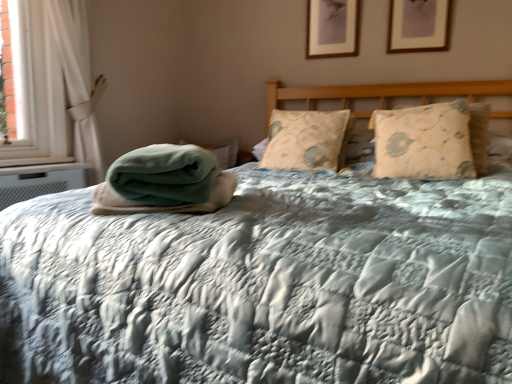
Question: Is beige quilted pillow at right, the first pillow positioned from the right, oriented away from white fabric curtain at left?

Choices:
 (A) no
 (B) yes

Answer: (A)

Question: From a real-world perspective, is beige quilted pillow at right, the first pillow positioned from the right, below white fabric curtain at left?

Choices:
 (A) yes
 (B) no

Answer: (A)

Question: Can you confirm if beige quilted pillow at right, the first pillow positioned from the right, is wider than white fabric curtain at left?

Choices:
 (A) yes
 (B) no

Answer: (A)

Question: Does beige quilted pillow at right, the first pillow positioned from the right, appear on the right side of white fabric curtain at left?

Choices:
 (A) yes
 (B) no

Answer: (A)

Question: Considering the relative positions of beige quilted pillow at right, placed as the second pillow when sorted from left to right, and white fabric curtain at left in the image provided, is beige quilted pillow at right, placed as the second pillow when sorted from left to right, behind white fabric curtain at left?

Choices:
 (A) yes
 (B) no

Answer: (B)

Question: Based on their sizes in the image, would you say beige quilted pillow at right, placed as the second pillow when sorted from left to right, is bigger or smaller than matte wooden picture frame at upper center, the second picture frame viewed from the right?

Choices:
 (A) small
 (B) big

Answer: (B)

Question: Considering the positions of beige quilted pillow at right, the first pillow positioned from the right, and matte wooden picture frame at upper center, the second picture frame viewed from the right, in the image, is beige quilted pillow at right, the first pillow positioned from the right, wider or thinner than matte wooden picture frame at upper center, the second picture frame viewed from the right,?

Choices:
 (A) thin
 (B) wide

Answer: (B)

Question: Does point click(442, 130) appear closer or farther from the camera than point click(334, 44)?

Choices:
 (A) closer
 (B) farther

Answer: (A)

Question: From the image's perspective, is beige quilted pillow at right, placed as the second pillow when sorted from left to right, above or below matte wooden picture frame at upper center, which is the 1th picture frame from left to right?

Choices:
 (A) below
 (B) above

Answer: (A)

Question: Is point click(x=197, y=148) positioned closer to the camera than point click(x=338, y=56)?

Choices:
 (A) farther
 (B) closer

Answer: (B)

Question: From a real-world perspective, is green textured blanket at center positioned above or below matte wooden picture frame at upper center, the second picture frame viewed from the right?

Choices:
 (A) above
 (B) below

Answer: (B)

Question: Considering the positions of green textured blanket at center and matte wooden picture frame at upper center, which is the 1th picture frame from left to right, in the image, is green textured blanket at center bigger or smaller than matte wooden picture frame at upper center, which is the 1th picture frame from left to right,?

Choices:
 (A) big
 (B) small

Answer: (A)

Question: Looking at their shapes, would you say green textured blanket at center is wider or thinner than matte wooden picture frame at upper center, the second picture frame viewed from the right?

Choices:
 (A) thin
 (B) wide

Answer: (B)

Question: Considering the relative positions of wooden picture frame at upper center, arranged as the 2th picture frame when viewed from the left, and green textured blanket at center in the image provided, is wooden picture frame at upper center, arranged as the 2th picture frame when viewed from the left, to the left or to the right of green textured blanket at center?

Choices:
 (A) left
 (B) right

Answer: (B)

Question: Is wooden picture frame at upper center, which is the 2th picture frame from back to front, in front of or behind green textured blanket at center in the image?

Choices:
 (A) behind
 (B) front

Answer: (A)